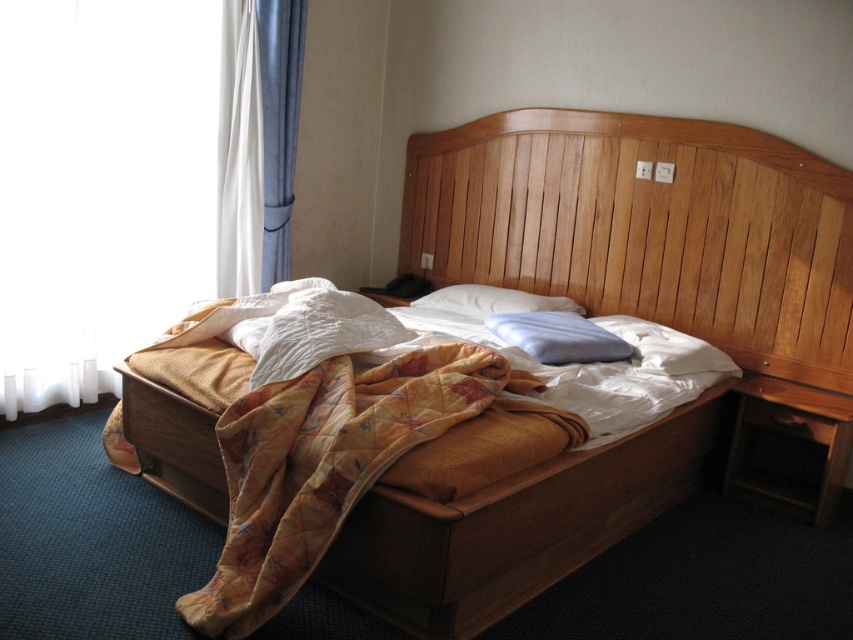
Does quilted orange bed at center have a greater height compared to white quilted fabric at center?

Indeed, quilted orange bed at center has a greater height compared to white quilted fabric at center.

Who is shorter, quilted orange bed at center or white quilted fabric at center?

white quilted fabric at center

Does point (701, 468) come behind point (659, 365)?

Yes, point (701, 468) is farther from viewer.

Where is `quilted orange bed at center`? The width and height of the screenshot is (853, 640). quilted orange bed at center is located at coordinates (606, 312).

Looking at this image, can you confirm if quilted orange bed at center is wider than wooden headboard at center?

Yes, quilted orange bed at center is wider than wooden headboard at center.

Does quilted orange bed at center have a smaller size compared to wooden headboard at center?

Actually, quilted orange bed at center might be larger than wooden headboard at center.

Between point (183, 426) and point (785, 346), which one is positioned in front?

Point (183, 426) is more forward.

This screenshot has width=853, height=640. Find the location of `quilted orange bed at center`. quilted orange bed at center is located at coordinates (606, 312).

Based on the photo, which is above, quilted orange blanket at center or white quilted fabric at center?

white quilted fabric at center is above.

Which is in front, point (328, 365) or point (544, 396)?

Point (328, 365)

Find the location of a particular element. This screenshot has height=640, width=853. quilted orange blanket at center is located at coordinates (323, 465).